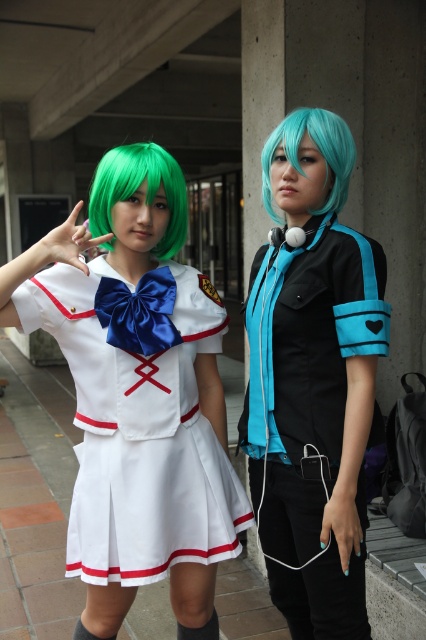
Question: Does matte white dress at center have a larger size compared to green matte wig at left?

Choices:
 (A) yes
 (B) no

Answer: (A)

Question: Can you confirm if matte black shirt at center is thinner than teal glossy wig at center?

Choices:
 (A) yes
 (B) no

Answer: (B)

Question: Which object is positioned farthest from the matte white dress at center?

Choices:
 (A) teal glossy wig at center
 (B) matte black shirt at center

Answer: (A)

Question: Which point appears farthest from the camera in this image?

Choices:
 (A) (106, 221)
 (B) (345, 564)
 (C) (117, 476)
 (D) (265, 150)

Answer: (D)

Question: Is matte white dress at center closer to the viewer compared to teal glossy wig at center?

Choices:
 (A) no
 (B) yes

Answer: (B)

Question: Which object appears farthest from the camera in this image?

Choices:
 (A) matte black shirt at center
 (B) green matte wig at left

Answer: (B)